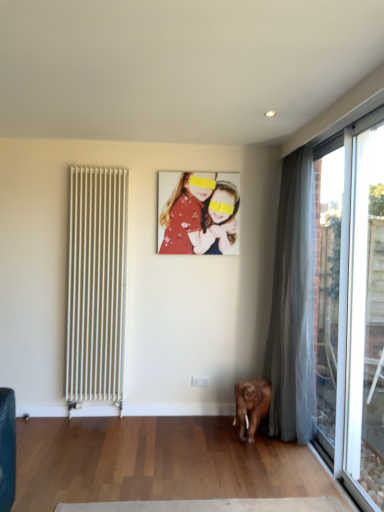
Question: Is matte floral dress at center thinner than silky gray curtain at right?

Choices:
 (A) yes
 (B) no

Answer: (A)

Question: Can you confirm if matte floral dress at center is wider than silky gray curtain at right?

Choices:
 (A) no
 (B) yes

Answer: (A)

Question: From the image's perspective, is matte floral dress at center on silky gray curtain at right?

Choices:
 (A) yes
 (B) no

Answer: (A)

Question: Is matte floral dress at center not close to silky gray curtain at right?

Choices:
 (A) no
 (B) yes

Answer: (A)

Question: Is matte floral dress at center next to silky gray curtain at right and touching it?

Choices:
 (A) no
 (B) yes

Answer: (A)

Question: Is matte floral dress at center further to camera compared to silky gray curtain at right?

Choices:
 (A) yes
 (B) no

Answer: (A)

Question: From the image's perspective, would you say white metal radiator at left is shown under matte floral dress at center?

Choices:
 (A) no
 (B) yes

Answer: (B)

Question: Is white metal radiator at left smaller than matte floral dress at center?

Choices:
 (A) no
 (B) yes

Answer: (A)

Question: Is there a large distance between white metal radiator at left and matte floral dress at center?

Choices:
 (A) yes
 (B) no

Answer: (B)

Question: Is white metal radiator at left not inside matte floral dress at center?

Choices:
 (A) yes
 (B) no

Answer: (A)

Question: Is white metal radiator at left oriented towards matte floral dress at center?

Choices:
 (A) no
 (B) yes

Answer: (A)

Question: From a real-world perspective, is white metal radiator at left located higher than matte floral dress at center?

Choices:
 (A) yes
 (B) no

Answer: (B)

Question: From the image's perspective, does silky gray curtain at right appear higher than transparent glass door at right, the 2th window from the back?

Choices:
 (A) yes
 (B) no

Answer: (A)